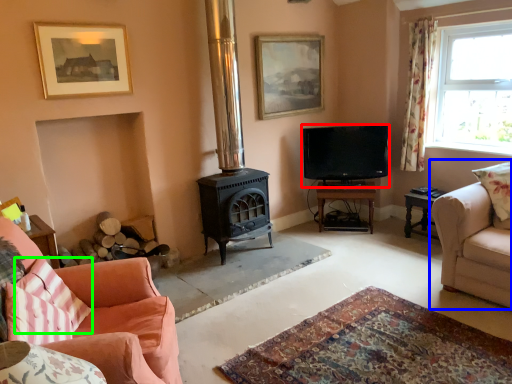
Question: Considering the real-world distances, which object is farthest from television (highlighted by a red box)? studio couch (highlighted by a blue box) or pillow (highlighted by a green box)?

Choices:
 (A) studio couch
 (B) pillow

Answer: (B)